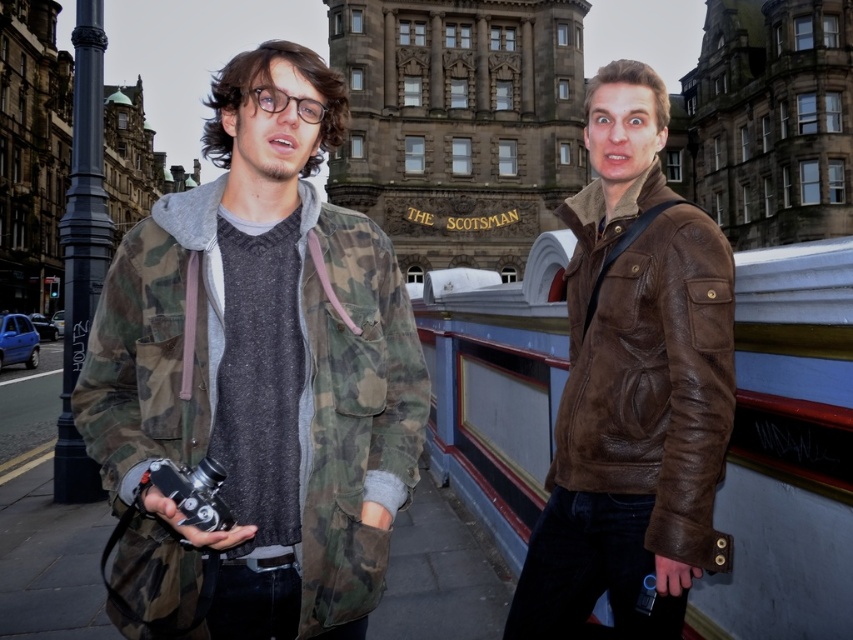
You are a photographer trying to decide where to place your matte black camera at lower left so that it doesn t get in the way of the brown leather jacket at right. Based on their sizes, which object should you prioritize positioning first?

The brown leather jacket at right is taller than the matte black camera at lower left, so you should prioritize positioning the brown leather jacket at right first to ensure there is enough space for its height.

You are a fashion designer observing two jackets in the scene. The camo jacket at center and the brown leather jacket at right. Which jacket would you recommend for someone who wants to create a bold and attention grabbing outfit?

The camo jacket at center is bigger than the brown leather jacket at right, making it a better choice for creating a bold and attention grabbing outfit.